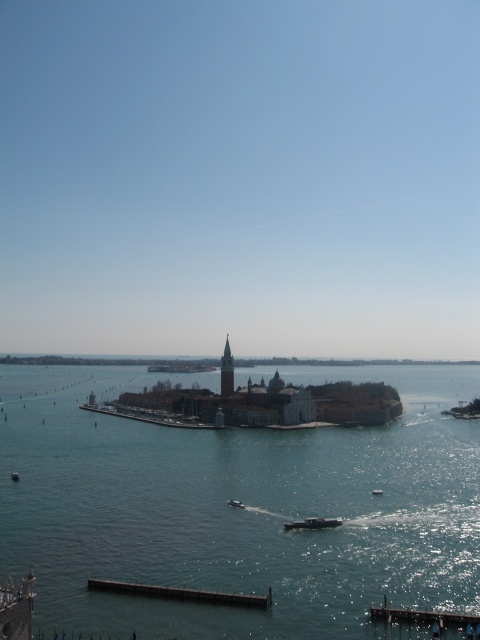
Does clear blue water at center have a lesser width compared to metallic silver boat at center?

No, clear blue water at center is not thinner than metallic silver boat at center.

Who is shorter, clear blue water at center or metallic silver boat at center?

Standing shorter between the two is metallic silver boat at center.

Identify the location of clear blue water at center. (238, 509).

In order to click on clear blue water at center in this screenshot , I will do `click(238, 509)`.

Is metallic gray boat at center above white plastic boat at center?

Yes.

Is metallic gray boat at center in front of white plastic boat at center?

Yes, metallic gray boat at center is closer to the viewer.

Does point (303, 524) come in front of point (373, 492)?

That is True.

In order to click on metallic gray boat at center in this screenshot , I will do `click(313, 524)`.

Image resolution: width=480 pixels, height=640 pixels. Find the location of `metallic silver boat at center`. metallic silver boat at center is located at coordinates (236, 502).

Between metallic silver boat at center and white plastic boat at center, which one is positioned lower?

white plastic boat at center is below.

I want to click on metallic silver boat at center, so click(x=236, y=502).